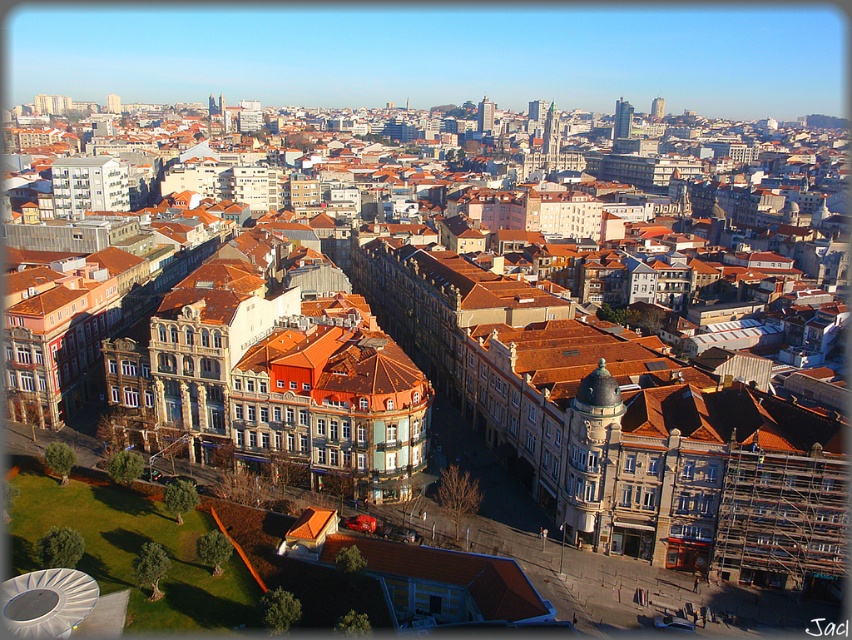
You are a city planner analyzing the urban layout. Given the image, which object among the matte copper dome at center and the smooth gray tower at center occupies a larger footprint in the city?

The smooth gray tower at center has a larger footprint than the matte copper dome at center, as it is described as being larger in size.

You are an architect analyzing the central area of this historic city. You observe the matte copper dome at center and the green stone tower at center. Which structure has a smaller width?

The matte copper dome at center has a smaller width than the green stone tower at center.

You are a tourist standing in the park and want to take a photo that includes both the matte copper dome at center and the smooth gray tower at center. Based on their positions, which object should you place on the left side of your camera frame to capture both in the shot?

Since the matte copper dome at center is to the left of the smooth gray tower at center, you should position the matte copper dome at center on the left side of your camera frame to include both in the shot.